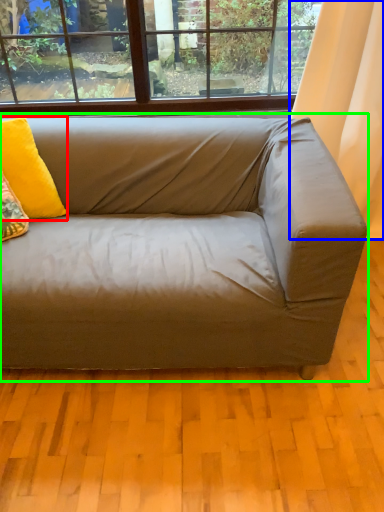
Question: Estimate the real-world distances between objects in this image. Which object is farther from pillow (highlighted by a red box), curtain (highlighted by a blue box) or studio couch (highlighted by a green box)?

Choices:
 (A) curtain
 (B) studio couch

Answer: (A)